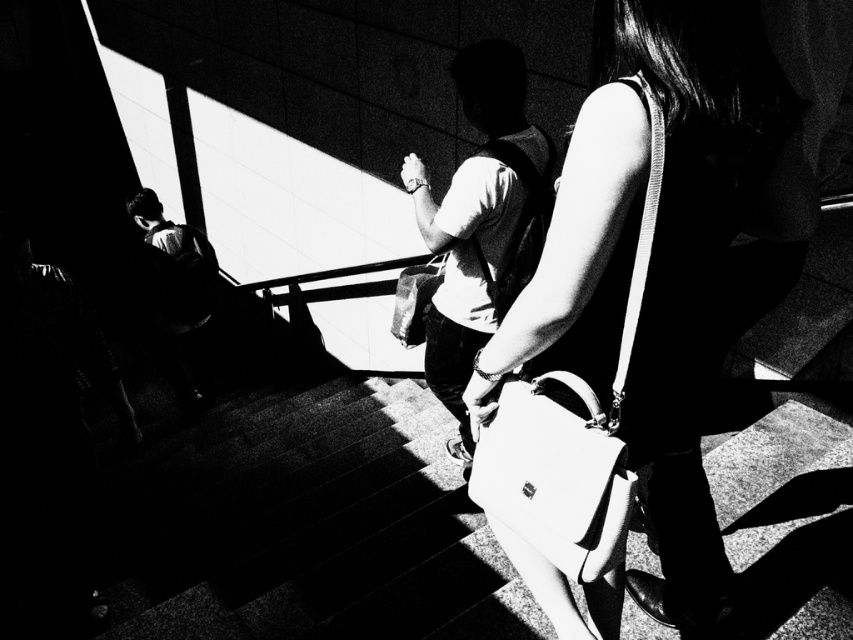
Question: Does matte white handbag at center have a smaller size compared to dark fabric backpack at left?

Choices:
 (A) no
 (B) yes

Answer: (B)

Question: Is white leather handbag at center bigger than dark fabric backpack at left?

Choices:
 (A) no
 (B) yes

Answer: (A)

Question: Which of the following is the closest to the observer?

Choices:
 (A) (611, 433)
 (B) (190, 257)
 (C) (514, 454)

Answer: (A)

Question: Which object is the farthest from the white leather handbag at center?

Choices:
 (A) white leather shoulder bag at center
 (B) matte white handbag at center
 (C) dark fabric backpack at left

Answer: (C)

Question: Which point appears closest to the camera in this image?

Choices:
 (A) (582, 557)
 (B) (618, 442)
 (C) (695, 230)

Answer: (C)

Question: From the image, what is the correct spatial relationship of matte white handbag at center in relation to white leather shoulder bag at center?

Choices:
 (A) left
 (B) right

Answer: (B)